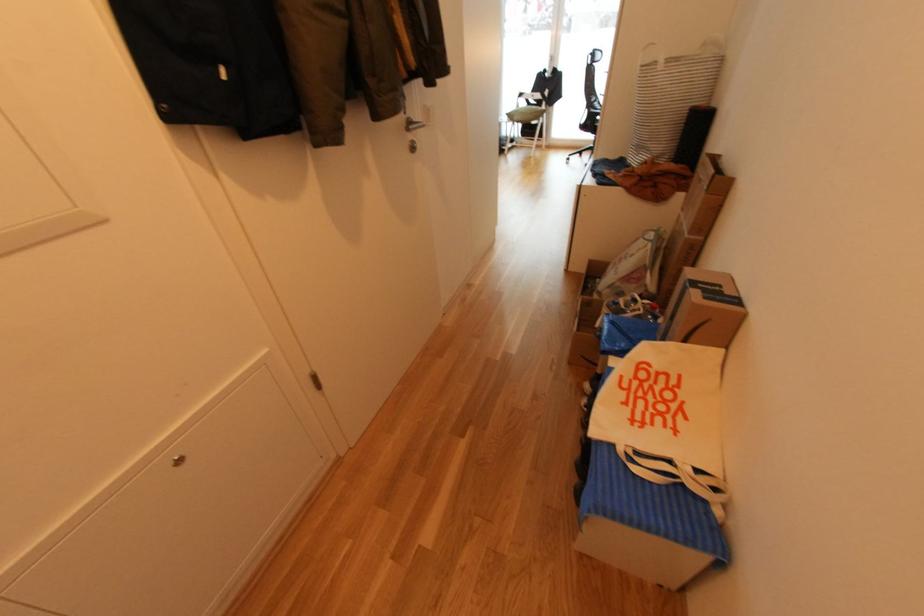
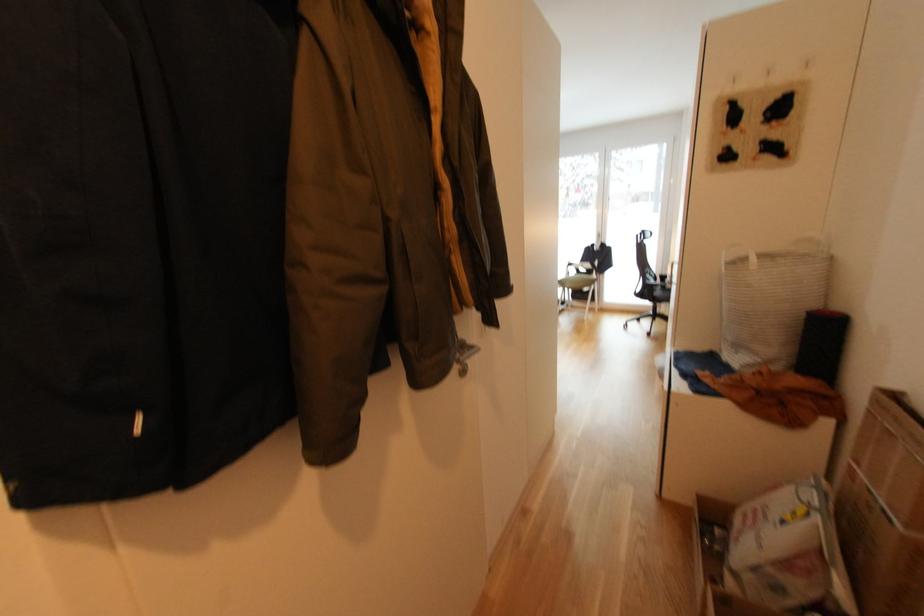
Question: The images are taken continuously from a first-person perspective. In which direction are you moving?

Choices:
 (A) Left
 (B) Right
 (C) Forward
 (D) Backward

Answer: (C)